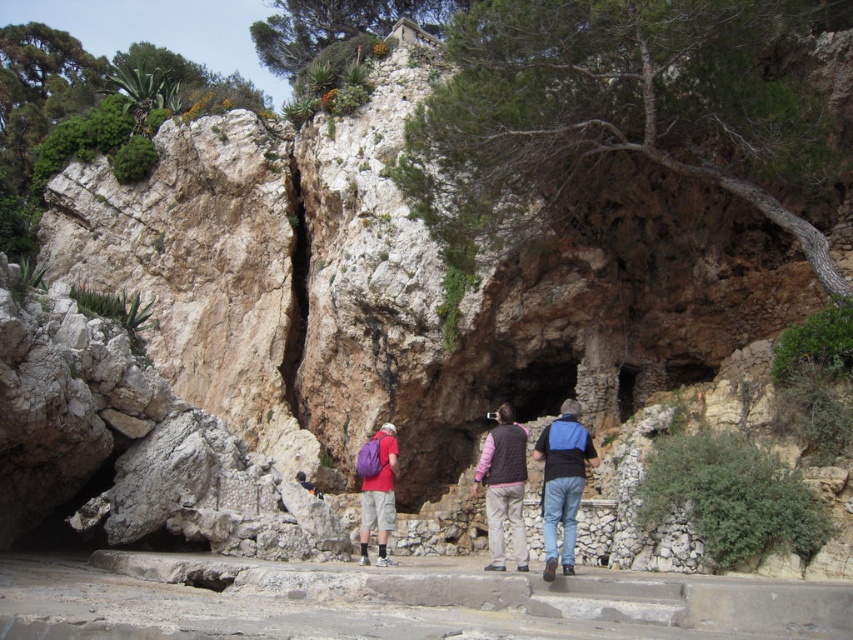
You are a hiker standing in front of the rock formation and want to take a photo of the pink fleece vest at center and the purple fabric backpack at center. Which object should you focus on first to ensure both are in focus?

You should focus on the pink fleece vest at center first because it is closer to the viewer than the purple fabric backpack at center, so adjusting focus from near to far will help both be in focus.